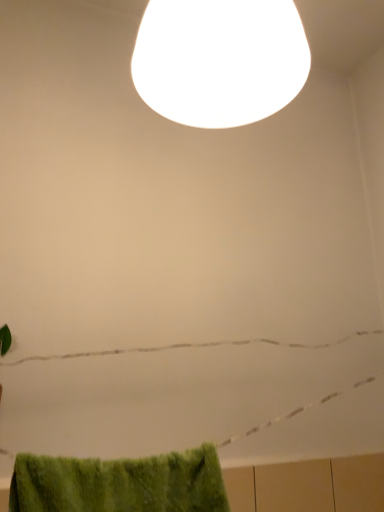
This screenshot has width=384, height=512. What do you see at coordinates (220, 60) in the screenshot?
I see `white glossy lampshade at upper center` at bounding box center [220, 60].

Measure the distance between point (x=191, y=82) and camera.

A distance of 26.38 inches exists between point (x=191, y=82) and camera.

Locate an element on the screen. white glossy lampshade at upper center is located at coordinates (220, 60).

What is the approximate height of white glossy lampshade at upper center?

The height of white glossy lampshade at upper center is 12.49 inches.

What is the approximate width of white glossy lampshade at upper center?

The width of white glossy lampshade at upper center is 25.05 centimeters.

Where is `green fuzzy bath towel at lower left`? The height and width of the screenshot is (512, 384). green fuzzy bath towel at lower left is located at coordinates (120, 483).

Describe the element at coordinates (120, 483) in the screenshot. I see `green fuzzy bath towel at lower left` at that location.

In order to face green fuzzy bath towel at lower left, should I rotate leftwards or rightwards?

To face it directly, rotate left by 8.465 degrees.

Locate an element on the screen. The image size is (384, 512). white glossy lampshade at upper center is located at coordinates (220, 60).

In the image, is green fuzzy bath towel at lower left on the left side or the right side of white glossy lampshade at upper center?

In the image, green fuzzy bath towel at lower left appears on the left side of white glossy lampshade at upper center.

Who is more distant, green fuzzy bath towel at lower left or white glossy lampshade at upper center?

green fuzzy bath towel at lower left is behind.

Is point (79, 477) farther from camera compared to point (170, 57)?

No, (79, 477) is closer to viewer.

From the image's perspective, is green fuzzy bath towel at lower left positioned above or below white glossy lampshade at upper center?

green fuzzy bath towel at lower left is situated lower than white glossy lampshade at upper center in the image.

From a real-world perspective, which is physically above, green fuzzy bath towel at lower left or white glossy lampshade at upper center?

white glossy lampshade at upper center, from a real-world perspective.

Does green fuzzy bath towel at lower left have a greater width compared to white glossy lampshade at upper center?

No, green fuzzy bath towel at lower left is not wider than white glossy lampshade at upper center.

Considering the relative sizes of green fuzzy bath towel at lower left and white glossy lampshade at upper center in the image provided, is green fuzzy bath towel at lower left shorter than white glossy lampshade at upper center?

Indeed, green fuzzy bath towel at lower left has a lesser height compared to white glossy lampshade at upper center.

Considering the relative sizes of green fuzzy bath towel at lower left and white glossy lampshade at upper center in the image provided, is green fuzzy bath towel at lower left bigger than white glossy lampshade at upper center?

Incorrect, green fuzzy bath towel at lower left is not larger than white glossy lampshade at upper center.

Choose the correct answer: Is green fuzzy bath towel at lower left inside white glossy lampshade at upper center or outside it?

green fuzzy bath towel at lower left is spatially situated outside white glossy lampshade at upper center.

Is green fuzzy bath towel at lower left next to white glossy lampshade at upper center?

No, green fuzzy bath towel at lower left is not with white glossy lampshade at upper center.

Is green fuzzy bath towel at lower left oriented towards white glossy lampshade at upper center?

No, green fuzzy bath towel at lower left is not oriented towards white glossy lampshade at upper center.

Can you tell me how much green fuzzy bath towel at lower left and white glossy lampshade at upper center differ in facing direction?

0.00136 degrees.

There is a green fuzzy bath towel at lower left. Find the location of `lamp above it (from a real-world perspective)`. lamp above it (from a real-world perspective) is located at coordinates (220, 60).

Visually, is white glossy lampshade at upper center positioned to the left or to the right of green fuzzy bath towel at lower left?

white glossy lampshade at upper center is to the right of green fuzzy bath towel at lower left.

Is white glossy lampshade at upper center positioned before green fuzzy bath towel at lower left?

Yes, the depth of white glossy lampshade at upper center is less than that of green fuzzy bath towel at lower left.

Between point (143, 84) and point (108, 508), which one is positioned in front?

Positioned in front is point (143, 84).

From the image's perspective, which is above, white glossy lampshade at upper center or green fuzzy bath towel at lower left?

white glossy lampshade at upper center is shown above in the image.

From a real-world perspective, between white glossy lampshade at upper center and green fuzzy bath towel at lower left, who is vertically higher?

white glossy lampshade at upper center, from a real-world perspective.

Looking at their sizes, would you say white glossy lampshade at upper center is wider or thinner than green fuzzy bath towel at lower left?

white glossy lampshade at upper center is wider than green fuzzy bath towel at lower left.

Which of these two, white glossy lampshade at upper center or green fuzzy bath towel at lower left, stands shorter?

green fuzzy bath towel at lower left.

Considering the relative sizes of white glossy lampshade at upper center and green fuzzy bath towel at lower left in the image provided, is white glossy lampshade at upper center smaller than green fuzzy bath towel at lower left?

No.

Which is correct: white glossy lampshade at upper center is inside green fuzzy bath towel at lower left, or outside of it?

white glossy lampshade at upper center is not inside green fuzzy bath towel at lower left, it's outside.

Is there a large distance between white glossy lampshade at upper center and green fuzzy bath towel at lower left?

No, there isn't a large distance between white glossy lampshade at upper center and green fuzzy bath towel at lower left.

Is white glossy lampshade at upper center facing towards green fuzzy bath towel at lower left?

No, white glossy lampshade at upper center is not oriented towards green fuzzy bath towel at lower left.

How many degrees apart are the facing directions of white glossy lampshade at upper center and green fuzzy bath towel at lower left?

They differ by 0.00136 degrees in their facing directions.

You are a GUI agent. You are given a task and a screenshot of the screen. Output one action in this format:
    pyautogui.click(x=<x>, y=<y>)
    Task: Click on the bath towel below the white glossy lampshade at upper center (from the image's perspective)
    
    Given the screenshot: What is the action you would take?
    pyautogui.click(x=120, y=483)

At what (x,y) coordinates should I click in order to perform the action: click on lamp that is in front of the green fuzzy bath towel at lower left. Please return your answer as a coordinate pair (x, y). This screenshot has width=384, height=512. Looking at the image, I should click on (220, 60).

In the image, there is a white glossy lampshade at upper center. What are the coordinates of `bath towel below it (from the image's perspective)` in the screenshot? It's located at (120, 483).